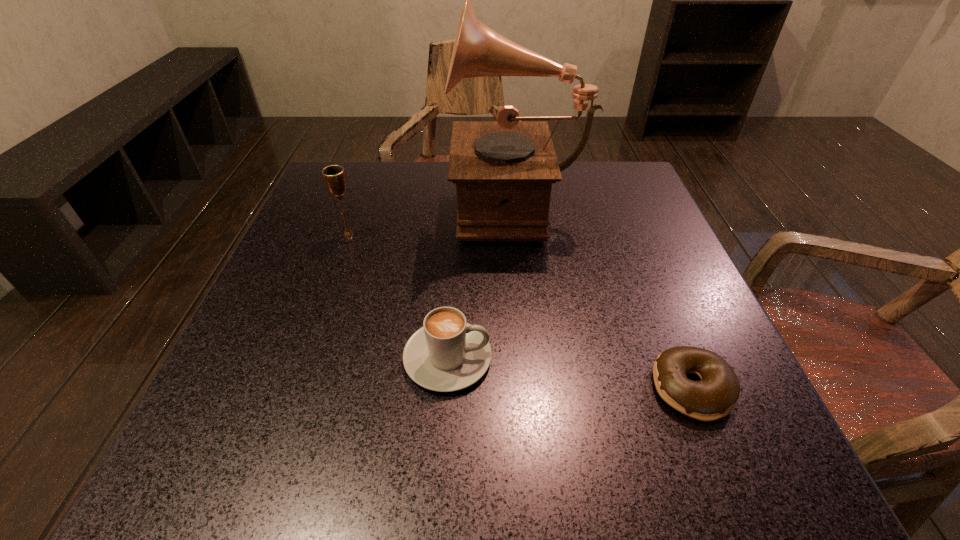
I want to click on free space between the tallest object and the shortest object, so click(x=604, y=295).

At what (x,y) coordinates should I click in order to perform the action: click on free space between the record player and the cappuccino. Please return your answer as a coordinate pair (x, y). Looking at the image, I should click on (482, 280).

Locate an element on the screen. This screenshot has height=540, width=960. free point between the doughnut and the record player is located at coordinates (604, 295).

Choose which object is the third nearest neighbor to the rightmost object. Please provide its 2D coordinates. Your answer should be formatted as a tuple, i.e. [(x, y)], where the tuple contains the x and y coordinates of a point satisfying the conditions above.

[(334, 176)]

You are a GUI agent. You are given a task and a screenshot of the screen. Output one action in this format:
    pyautogui.click(x=<x>, y=<y>)
    Task: Click on the object that stands as the third closest to the tallest object
    The width and height of the screenshot is (960, 540).
    Given the screenshot: What is the action you would take?
    point(714,397)

Locate an element on the screen. The width and height of the screenshot is (960, 540). vacant space that satisfies the following two spatial constraints: 1. on the horn of the rightmost object; 2. on the left side of the record player is located at coordinates (536, 388).

Identify the location of vacant region that satisfies the following two spatial constraints: 1. on the horn of the record player; 2. on the front side of the third shortest object. This screenshot has width=960, height=540. (519, 234).

Where is `free location that satisfies the following two spatial constraints: 1. to the right of the cappuccino; 2. on the right side of the doughnut`? This screenshot has width=960, height=540. free location that satisfies the following two spatial constraints: 1. to the right of the cappuccino; 2. on the right side of the doughnut is located at coordinates (445, 388).

You are a GUI agent. You are given a task and a screenshot of the screen. Output one action in this format:
    pyautogui.click(x=<x>, y=<y>)
    Task: Click on the free location that satisfies the following two spatial constraints: 1. to the right of the third tallest object; 2. on the right side of the doughnut
    
    Given the screenshot: What is the action you would take?
    pyautogui.click(x=445, y=388)

Where is `free location that satisfies the following two spatial constraints: 1. on the horn of the shortest object; 2. on the left side of the tallest object`? This screenshot has height=540, width=960. free location that satisfies the following two spatial constraints: 1. on the horn of the shortest object; 2. on the left side of the tallest object is located at coordinates (536, 388).